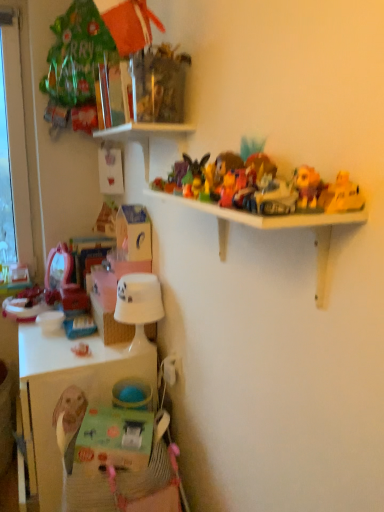
Locate an element on the screen. Image resolution: width=384 pixels, height=512 pixels. free location above white glossy lampshade at lower center (from a real-world perspective) is located at coordinates (140, 276).